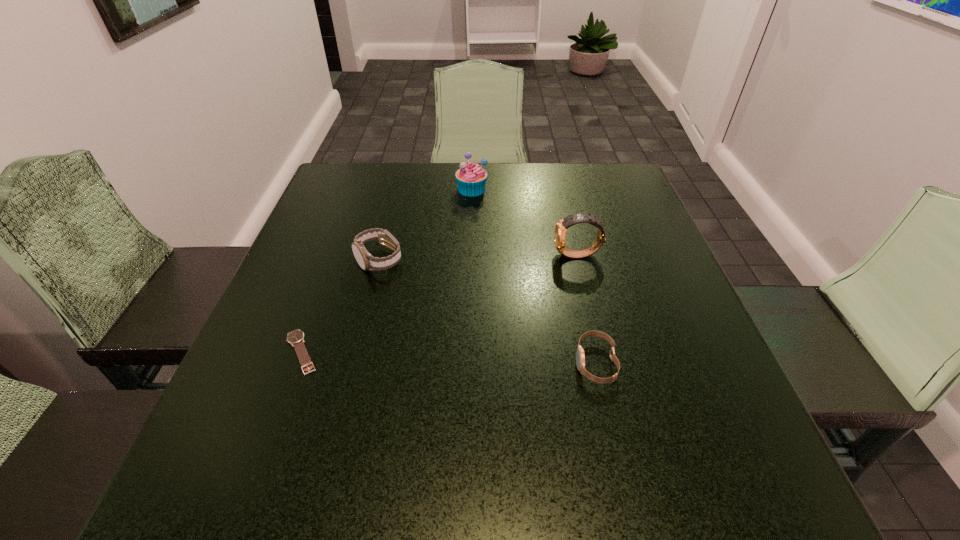
The width and height of the screenshot is (960, 540). Find the location of `the tallest watch`. the tallest watch is located at coordinates (561, 227).

In order to click on muffin in this screenshot , I will do `click(471, 177)`.

This screenshot has height=540, width=960. In order to click on the farthest object in this screenshot , I will do `click(471, 177)`.

You are a GUI agent. You are given a task and a screenshot of the screen. Output one action in this format:
    pyautogui.click(x=<x>, y=<y>)
    Task: Click on the third shortest watch
    The height and width of the screenshot is (540, 960).
    Given the screenshot: What is the action you would take?
    pyautogui.click(x=366, y=261)

Where is `the third shortest object`? This screenshot has height=540, width=960. the third shortest object is located at coordinates (366, 261).

Where is `the second shortest object`? This screenshot has height=540, width=960. the second shortest object is located at coordinates (580, 356).

Image resolution: width=960 pixels, height=540 pixels. Find the location of `the shortest watch`. the shortest watch is located at coordinates (296, 338).

The height and width of the screenshot is (540, 960). Find the location of `the leftmost object`. the leftmost object is located at coordinates pos(296,338).

Image resolution: width=960 pixels, height=540 pixels. I want to click on vacant position located on the face of the tallest watch, so click(488, 255).

I want to click on blank space located 0.400m on the face of the tallest watch, so click(378, 255).